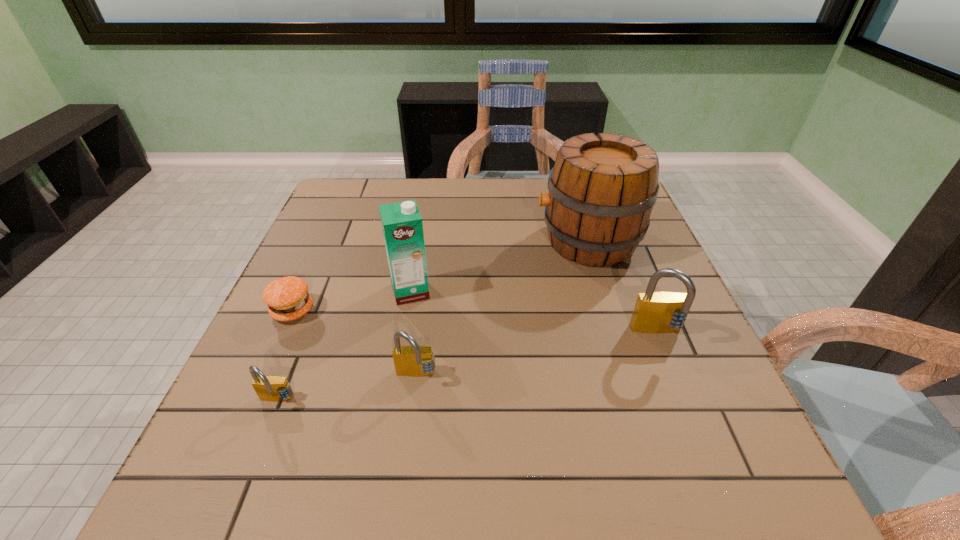
Identify which object is the second nearest to the shortest padlock. Please provide its 2D coordinates. Your answer should be formatted as a tuple, i.e. [(x, y)], where the tuple contains the x and y coordinates of a point satisfying the conditions above.

[(414, 361)]

You are a GUI agent. You are given a task and a screenshot of the screen. Output one action in this format:
    pyautogui.click(x=<x>, y=<y>)
    Task: Click on the object that can be found as the second closest to the tallest padlock
    This screenshot has width=960, height=540.
    Given the screenshot: What is the action you would take?
    pyautogui.click(x=414, y=361)

Identify which padlock is the nearest to the fifth tallest object. Please provide its 2D coordinates. Your answer should be formatted as a tuple, i.e. [(x, y)], where the tuple contains the x and y coordinates of a point satisfying the conditions above.

[(414, 361)]

The height and width of the screenshot is (540, 960). What are the coordinates of `padlock that stands as the second closest to the carton` in the screenshot? It's located at (268, 388).

This screenshot has height=540, width=960. In order to click on vacant region that satisfies the following two spatial constraints: 1. on the side of the farthest object where the spigot is located; 2. on the side with the combination dials of the leftmost padlock in this screenshot , I will do `click(637, 402)`.

Find the location of a particular element. The height and width of the screenshot is (540, 960). free spot that satisfies the following two spatial constraints: 1. on the side of the cider where the spigot is located; 2. on the side with the combination dials of the nearest padlock is located at coordinates (637, 402).

Locate an element on the screen. The width and height of the screenshot is (960, 540). vacant region that satisfies the following two spatial constraints: 1. on the side of the farthest object where the spigot is located; 2. on the side with the combination dials of the third shortest object is located at coordinates (630, 376).